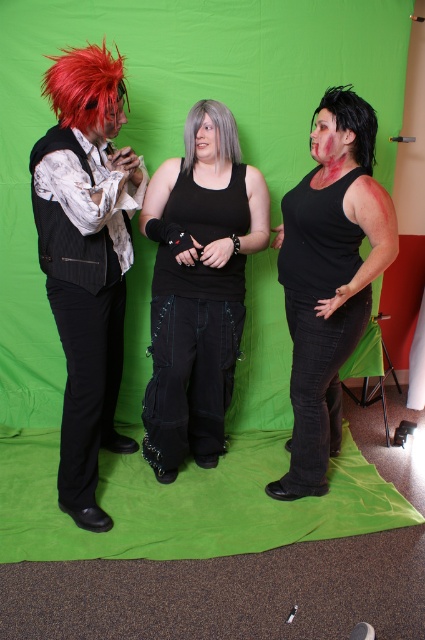
Question: Estimate the real-world distances between objects in this image. Which object is closer to the matte black vest at center?

Choices:
 (A) shiny black vest at left
 (B) black matte tank top at center
 (C) gray matte wig at center
 (D) black matte hair at center

Answer: (D)

Question: Which object is farther from the camera taking this photo?

Choices:
 (A) shiny black vest at left
 (B) gray matte wig at center

Answer: (B)

Question: Considering the relative positions of shiny black vest at left and black matte tank top at center in the image provided, where is shiny black vest at left located with respect to black matte tank top at center?

Choices:
 (A) above
 (B) below

Answer: (A)

Question: Which point is closer to the camera taking this photo?

Choices:
 (A) (187, 128)
 (B) (367, 125)
 (C) (342, 116)
 (D) (57, 248)

Answer: (D)

Question: Does black matte tank top at center appear over matte black vest at center?

Choices:
 (A) yes
 (B) no

Answer: (A)

Question: Where is shiny black vest at left located in relation to matte black vest at center in the image?

Choices:
 (A) below
 (B) above

Answer: (B)